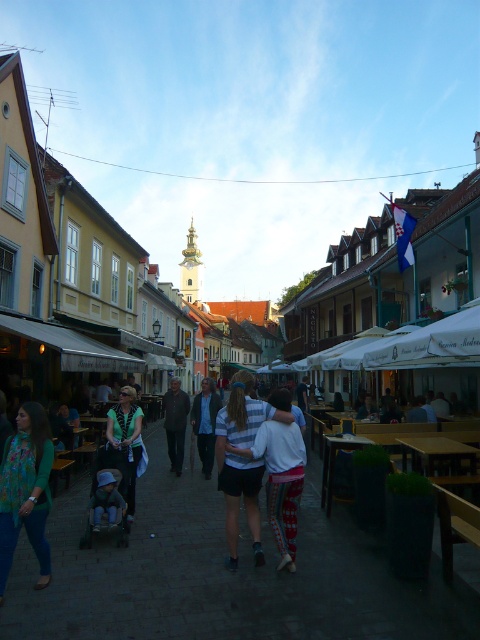
Who is lower down, green textured sweater at lower left or green fabric shirt at center?

green textured sweater at lower left

Can you confirm if green textured sweater at lower left is bigger than green fabric shirt at center?

Indeed, green textured sweater at lower left has a larger size compared to green fabric shirt at center.

At what (x,y) coordinates should I click in order to perform the action: click on green textured sweater at lower left. Please return your answer as a coordinate pair (x, y). This screenshot has height=640, width=480. Looking at the image, I should click on (25, 490).

Is point (286, 429) behind point (210, 451)?

No.

Can you confirm if striped fabric shirt at center is positioned to the left of blue denim jacket at center?

In fact, striped fabric shirt at center is to the right of blue denim jacket at center.

This screenshot has height=640, width=480. In order to click on striped fabric shirt at center in this screenshot , I will do `click(279, 481)`.

Can you confirm if striped fabric shirt at center is positioned to the left of green fabric shirt at center?

In fact, striped fabric shirt at center is to the right of green fabric shirt at center.

Does striped fabric shirt at center have a greater width compared to green fabric shirt at center?

Indeed, striped fabric shirt at center has a greater width compared to green fabric shirt at center.

At what (x,y) coordinates should I click in order to perform the action: click on striped fabric shirt at center. Please return your answer as a coordinate pair (x, y). The width and height of the screenshot is (480, 640). Looking at the image, I should click on (279, 481).